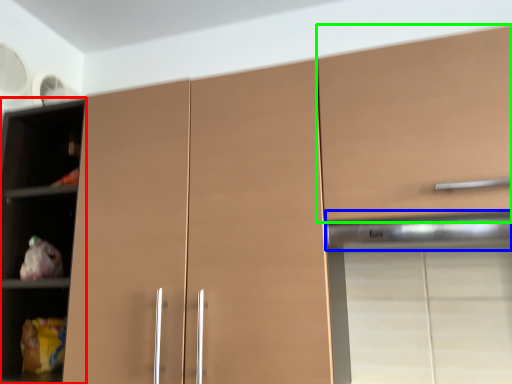
Question: Which object is the farthest from cupboard (highlighted by a red box)? Choose among these: exhaust hood (highlighted by a blue box) or cabinetry (highlighted by a green box).

Choices:
 (A) exhaust hood
 (B) cabinetry

Answer: (A)